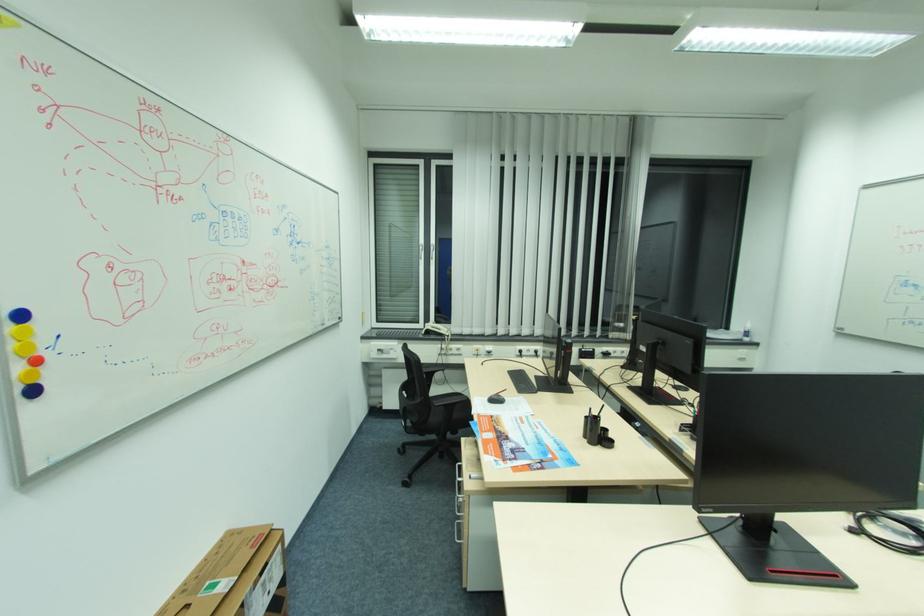
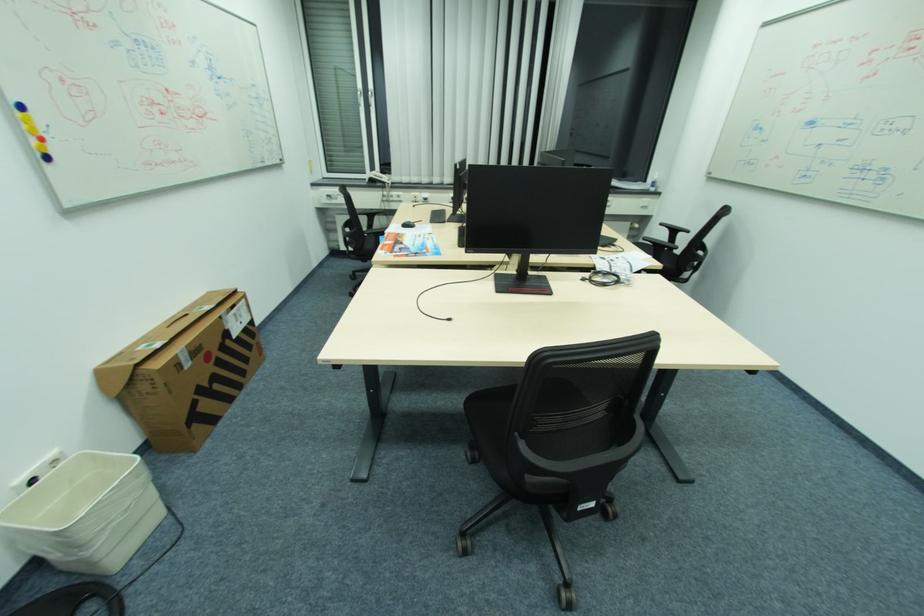
Where in the second image is the point corresponding to point 221,585 from the first image?

(207, 308)